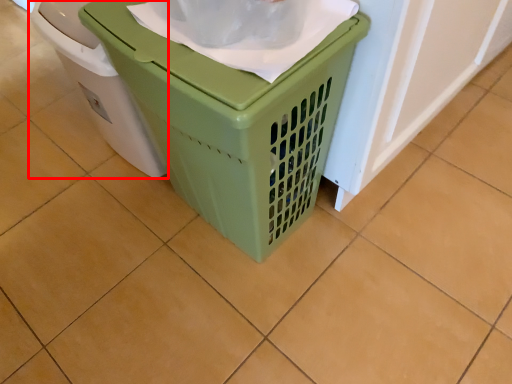
Question: Considering the relative positions of waste container (annotated by the red box) and waste container in the image provided, where is waste container (annotated by the red box) located with respect to the staircase?

Choices:
 (A) left
 (B) right

Answer: (A)